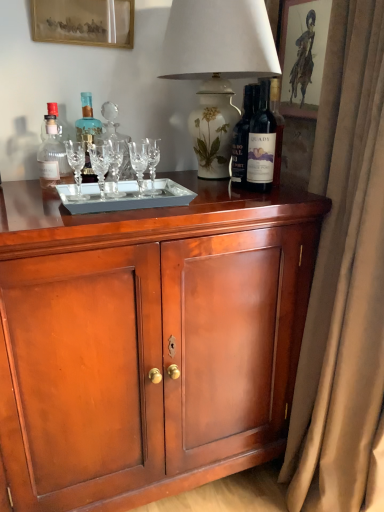
The height and width of the screenshot is (512, 384). I want to click on vacant area that lies in front of matte glass bottle at left, the third bottle from the right, so 34,196.